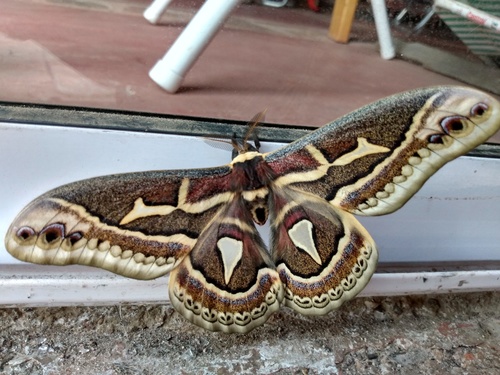
Locate an element on the screen. chair foot is located at coordinates (177, 55), (156, 10), (385, 36).